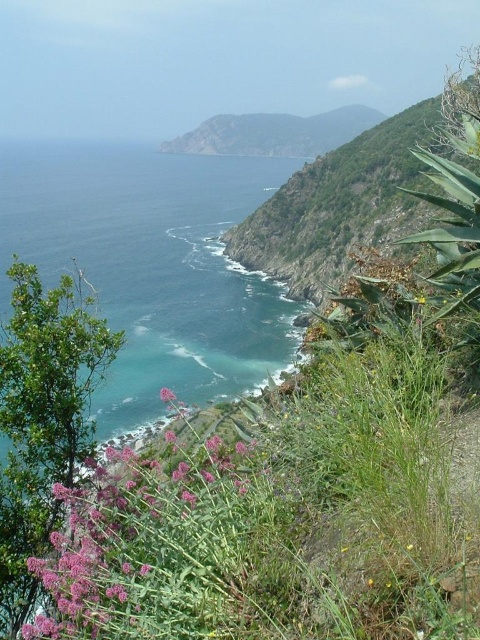
Question: Which point is farther from the camera taking this photo?

Choices:
 (A) click(294, 243)
 (B) click(171, 396)
 (C) click(62, 257)

Answer: (C)

Question: Is the position of pink fuzzy plant at lower left less distant than that of purple matte flower at lower left?

Choices:
 (A) no
 (B) yes

Answer: (B)

Question: From the image, what is the correct spatial relationship of green rough rock at center in relation to green grassy hillside at upper center?

Choices:
 (A) above
 (B) below

Answer: (B)

Question: Which point is closer to the camera taking this photo?

Choices:
 (A) (12, 250)
 (B) (152, 600)

Answer: (B)

Question: From the image, what is the correct spatial relationship of green rough rock at center in relation to purple matte flower at lower left?

Choices:
 (A) below
 (B) above

Answer: (B)

Question: Which point is farther from the camera taking this photo?

Choices:
 (A) (267, 262)
 (B) (169, 400)
 (C) (101, 253)

Answer: (C)